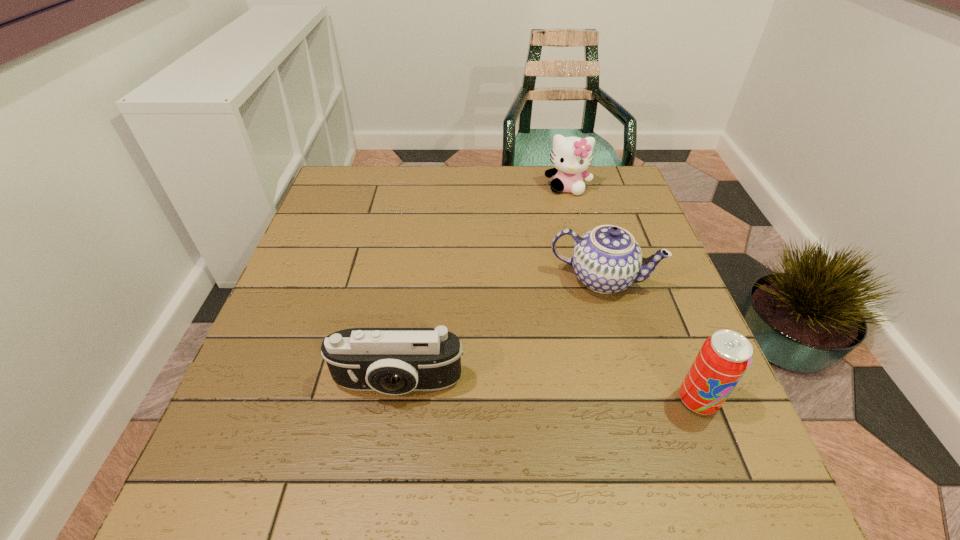
The height and width of the screenshot is (540, 960). I want to click on free spot between the leftmost object and the soda can, so click(548, 392).

You are a GUI agent. You are given a task and a screenshot of the screen. Output one action in this format:
    pyautogui.click(x=<x>, y=<y>)
    Task: Click on the unoccupied position between the farthest object and the camera
    
    Given the screenshot: What is the action you would take?
    pyautogui.click(x=483, y=286)

At what (x,y) coordinates should I click in order to perform the action: click on free space between the farthest object and the chinaware. Please return your answer as a coordinate pair (x, y). Looking at the image, I should click on (585, 233).

Where is `free space between the soda can and the camera`? The height and width of the screenshot is (540, 960). free space between the soda can and the camera is located at coordinates (548, 392).

Find the location of `blank region between the leftmost object and the soda can`. blank region between the leftmost object and the soda can is located at coordinates (548, 392).

Identify the location of vacant area that lies between the second farthest object and the kitten. The height and width of the screenshot is (540, 960). (585, 233).

Where is `vacant space that's between the soda can and the leftmost object`? The image size is (960, 540). vacant space that's between the soda can and the leftmost object is located at coordinates (548, 392).

Image resolution: width=960 pixels, height=540 pixels. Find the location of `free space between the chinaware and the camera`. free space between the chinaware and the camera is located at coordinates (500, 332).

Identify which object is the second nearest to the camera. Please provide its 2D coordinates. Your answer should be formatted as a tuple, i.e. [(x, y)], where the tuple contains the x and y coordinates of a point satisfying the conditions above.

[(724, 357)]

Point out which object is positioned as the third nearest to the leftmost object. Please provide its 2D coordinates. Your answer should be formatted as a tuple, i.e. [(x, y)], where the tuple contains the x and y coordinates of a point satisfying the conditions above.

[(571, 156)]